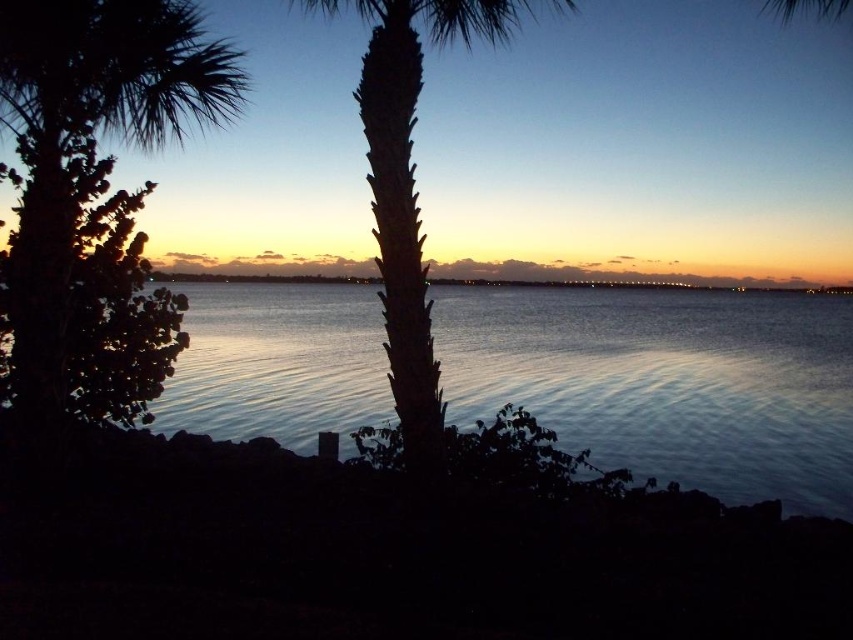
Can you confirm if silvery reflective water at center is positioned above dark green textured palm tree at center?

Incorrect, silvery reflective water at center is not positioned above dark green textured palm tree at center.

Which is below, silvery reflective water at center or dark green textured palm tree at center?

silvery reflective water at center is lower down.

Identify the location of silvery reflective water at center. The image size is (853, 640). (666, 381).

Where is `silvery reflective water at center`? This screenshot has height=640, width=853. silvery reflective water at center is located at coordinates coord(666,381).

In the scene shown: Can you confirm if silvery reflective water at center is taller than green leafy palm tree at upper left?

No.

Which of these two, silvery reflective water at center or green leafy palm tree at upper left, stands taller?

With more height is green leafy palm tree at upper left.

Who is more forward, (x=662, y=388) or (x=112, y=132)?

Point (x=112, y=132) is in front.

In order to click on silvery reflective water at center in this screenshot , I will do `click(666, 381)`.

Is green leafy palm tree at upper left positioned behind dark green textured palm tree at center?

Yes.

Who is more forward, (28, 163) or (508, 22)?

Point (28, 163) is in front.

This screenshot has width=853, height=640. I want to click on green leafy palm tree at upper left, so click(x=88, y=147).

Find the location of a particular element. green leafy palm tree at upper left is located at coordinates (88, 147).